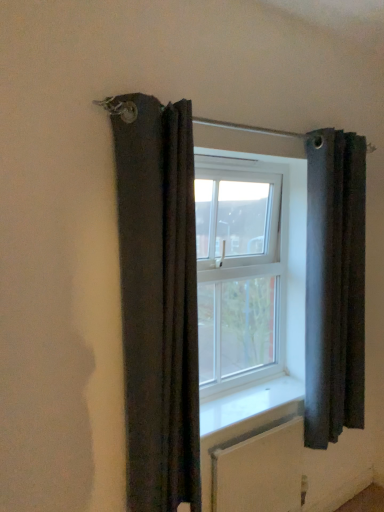
Question: Would you say clear glass window at center contains white smooth window sill at center?

Choices:
 (A) yes
 (B) no

Answer: (B)

Question: Considering the relative sizes of clear glass window at center and white smooth window sill at center in the image provided, is clear glass window at center bigger than white smooth window sill at center?

Choices:
 (A) no
 (B) yes

Answer: (B)

Question: From a real-world perspective, is clear glass window at center located beneath white smooth window sill at center?

Choices:
 (A) yes
 (B) no

Answer: (B)

Question: Is clear glass window at center oriented towards white smooth window sill at center?

Choices:
 (A) no
 (B) yes

Answer: (B)

Question: Can you confirm if clear glass window at center is positioned to the right of white smooth window sill at center?

Choices:
 (A) no
 (B) yes

Answer: (A)

Question: Is clear glass window at center closer to the viewer compared to white smooth window sill at center?

Choices:
 (A) yes
 (B) no

Answer: (B)

Question: Does white textured radiator at lower center have a smaller size compared to dark gray fabric curtain at right, the 1th curtain when ordered from back to front?

Choices:
 (A) yes
 (B) no

Answer: (A)

Question: Does white textured radiator at lower center have a lesser height compared to dark gray fabric curtain at right, the 1th curtain when ordered from back to front?

Choices:
 (A) yes
 (B) no

Answer: (A)

Question: Does white textured radiator at lower center appear on the right side of dark gray fabric curtain at right, acting as the 1th curtain starting from the right?

Choices:
 (A) yes
 (B) no

Answer: (B)

Question: Can you confirm if white textured radiator at lower center is positioned to the left of dark gray fabric curtain at right, the 1th curtain when ordered from back to front?

Choices:
 (A) yes
 (B) no

Answer: (A)

Question: Can you confirm if white textured radiator at lower center is wider than dark gray fabric curtain at right, acting as the 1th curtain starting from the right?

Choices:
 (A) no
 (B) yes

Answer: (A)

Question: Considering the relative sizes of white textured radiator at lower center and dark gray fabric curtain at right, acting as the 1th curtain starting from the right, in the image provided, is white textured radiator at lower center bigger than dark gray fabric curtain at right, acting as the 1th curtain starting from the right,?

Choices:
 (A) no
 (B) yes

Answer: (A)

Question: Considering the relative positions of dark gray fabric curtain at right, the 2th curtain in the left-to-right sequence, and white textured radiator at lower center in the image provided, is dark gray fabric curtain at right, the 2th curtain in the left-to-right sequence, in front of white textured radiator at lower center?

Choices:
 (A) yes
 (B) no

Answer: (B)